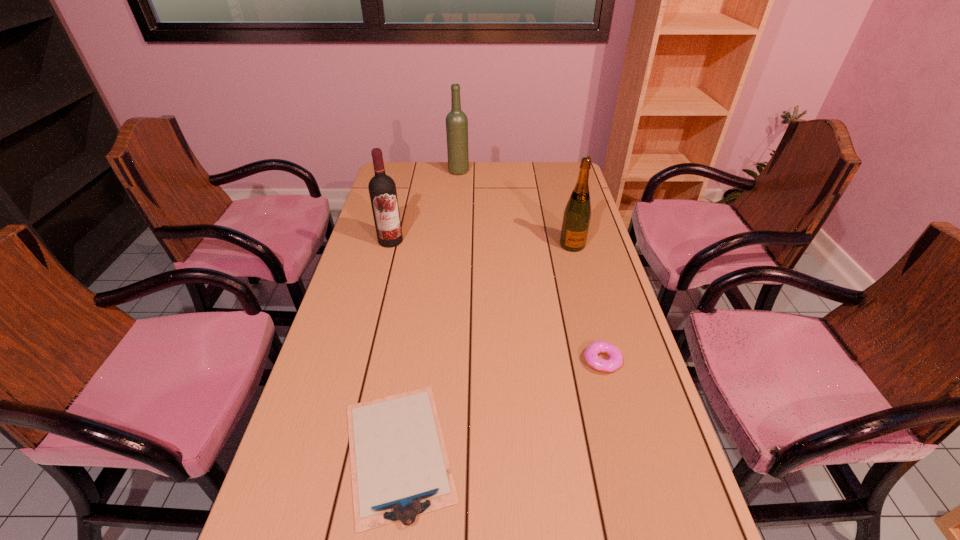
I want to click on the second wine bottle from left to right, so click(456, 121).

At what (x,y) coordinates should I click in order to perform the action: click on the farthest wine bottle. Please return your answer as a coordinate pair (x, y). Looking at the image, I should click on (456, 121).

Where is `the leftmost wine bottle`? the leftmost wine bottle is located at coordinates (382, 189).

The height and width of the screenshot is (540, 960). In order to click on the rightmost wine bottle in this screenshot , I will do `click(576, 219)`.

You are a GUI agent. You are given a task and a screenshot of the screen. Output one action in this format:
    pyautogui.click(x=<x>, y=<y>)
    Task: Click on the fourth farthest object
    
    Given the screenshot: What is the action you would take?
    pyautogui.click(x=591, y=353)

What are the coordinates of `doughnut` in the screenshot? It's located at (591, 353).

This screenshot has width=960, height=540. In order to click on the nearest object in this screenshot , I will do `click(400, 469)`.

This screenshot has height=540, width=960. I want to click on the shortest object, so (x=400, y=469).

I want to click on free space located on the front of the farthest wine bottle, so click(454, 224).

You are a GUI agent. You are given a task and a screenshot of the screen. Output one action in this format:
    pyautogui.click(x=<x>, y=<y>)
    Task: Click on the free space located 0.380m on the label of the leftmost wine bottle
    This screenshot has height=540, width=960.
    Given the screenshot: What is the action you would take?
    pyautogui.click(x=367, y=332)